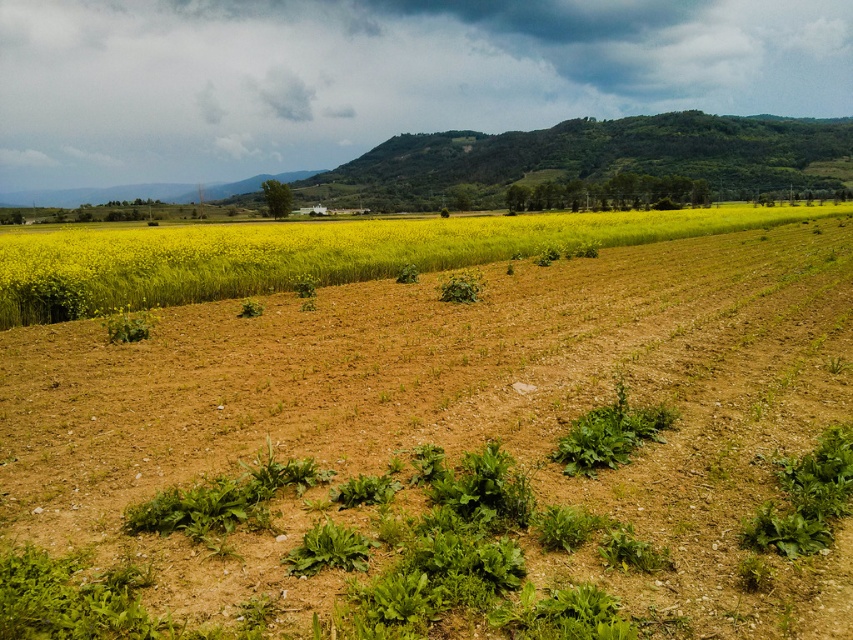
Consider the image. You are a farmer assessing the layout of your fields. You notice the brown soil at center and the green leafy plant at center. Which one is closer to you as you stand at the edge of the field?

The brown soil at center is closer to you because it is in front of the green leafy plant at center.

You are standing at the point labeled as point (436, 448) in the image. What type of terrain are you currently standing on?

You are standing on the brown soil at center.

You are a farmer assessing your fields. You notice the brown soil at center and the green leafy plant at center. Which one covers a larger area in the image?

The brown soil at center has a larger size compared to the green leafy plant at center, so the brown soil at center covers a larger area in the image.